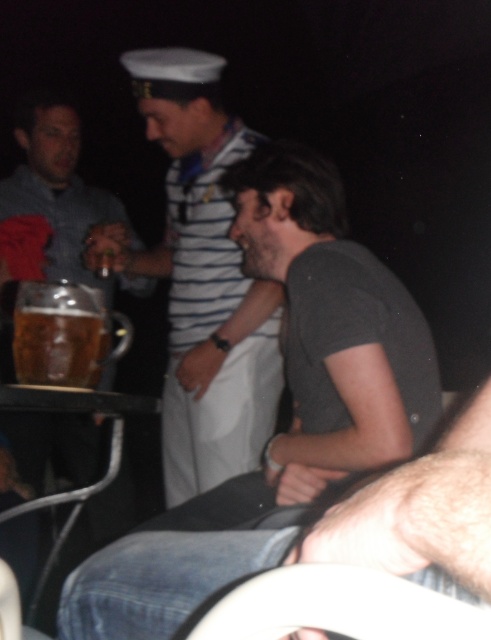
Does dark gray t-shirt at center appear over striped sailor shirt at center?

Actually, dark gray t-shirt at center is below striped sailor shirt at center.

Which of these two, dark gray t-shirt at center or striped sailor shirt at center, stands shorter?

With less height is dark gray t-shirt at center.

Find the location of `dark gray t-shirt at center`. dark gray t-shirt at center is located at coordinates (292, 397).

Can you confirm if dark gray t-shirt at center is positioned to the left of translucent glass mug at center?

Incorrect, dark gray t-shirt at center is not on the left side of translucent glass mug at center.

Is dark gray t-shirt at center closer to camera compared to translucent glass mug at center?

Yes, dark gray t-shirt at center is closer to the viewer.

Locate an element on the screen. The width and height of the screenshot is (491, 640). dark gray t-shirt at center is located at coordinates (292, 397).

Where is `dark gray t-shirt at center`? This screenshot has height=640, width=491. dark gray t-shirt at center is located at coordinates (292, 397).

Between striped sailor shirt at center and translucent glass mug at center, which one has more height?

striped sailor shirt at center is taller.

Who is more forward, (210, 109) or (23, 323)?

Point (23, 323) is more forward.

The image size is (491, 640). What are the coordinates of `striped sailor shirt at center` in the screenshot? It's located at (201, 280).